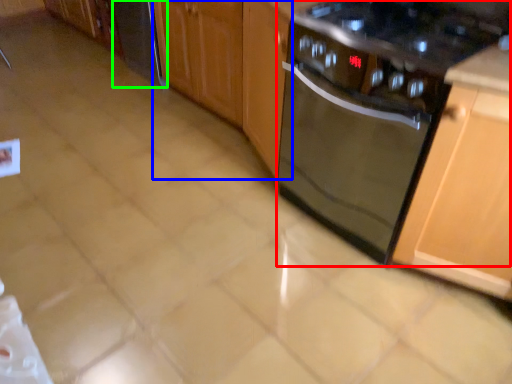
Question: Estimate the real-world distances between objects in this image. Which object is closer to kitchen appliance (highlighted by a red box), cabinetry (highlighted by a blue box) or appliance (highlighted by a green box)?

Choices:
 (A) cabinetry
 (B) appliance

Answer: (A)